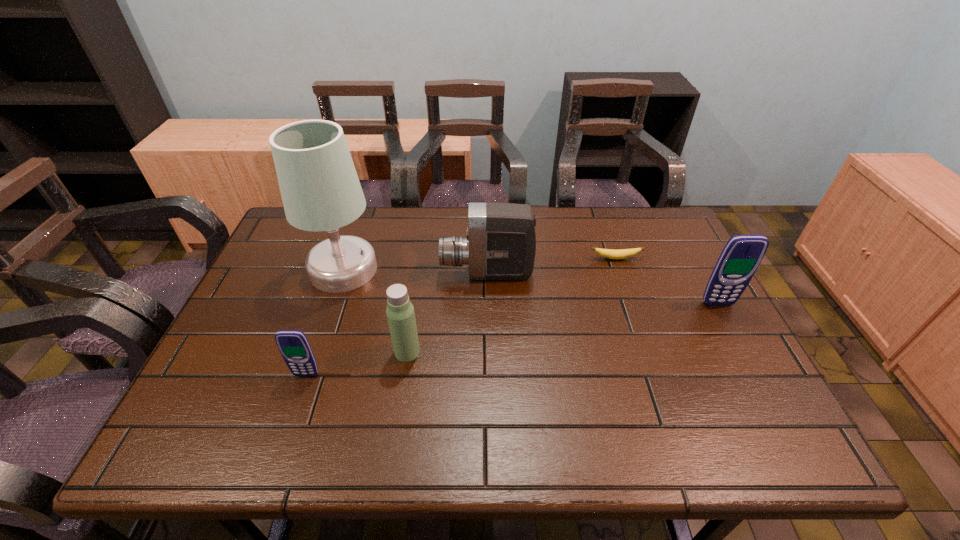
Please point a space for a new cellular_telephone to maintain equal intervals. Please provide its 2D coordinates. Your answer should be formatted as a tuple, i.e. [(x, y)], where the tuple contains the x and y coordinates of a point satisfying the conditions above.

[(527, 336)]